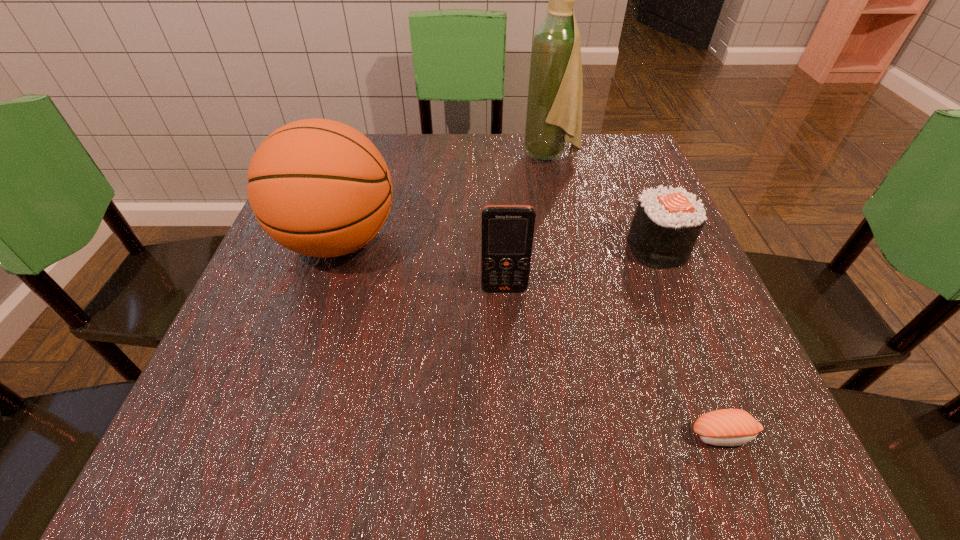
Locate an element on the screen. The width and height of the screenshot is (960, 540). vacant space that satisfies the following two spatial constraints: 1. on the screen of the shortest object; 2. on the right side of the cellular telephone is located at coordinates (512, 435).